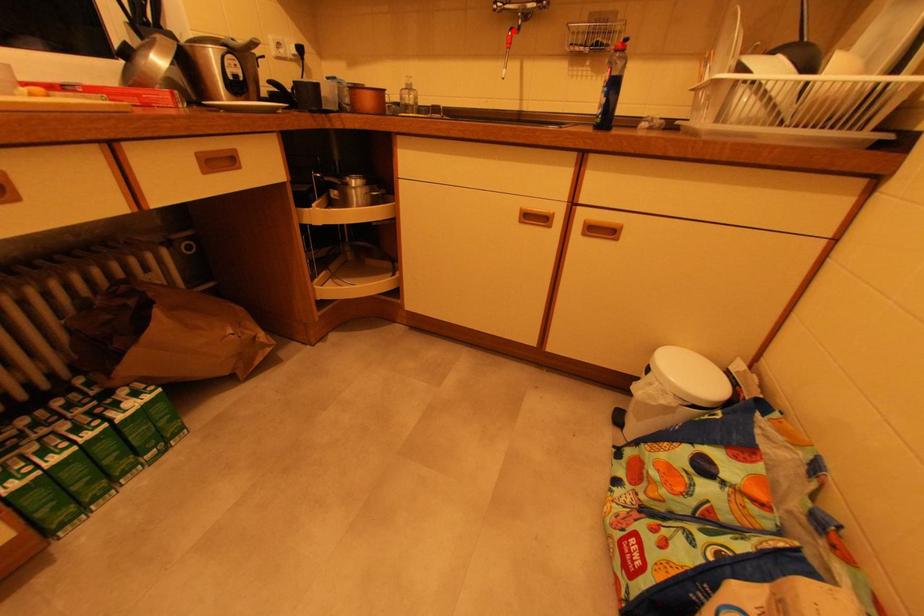
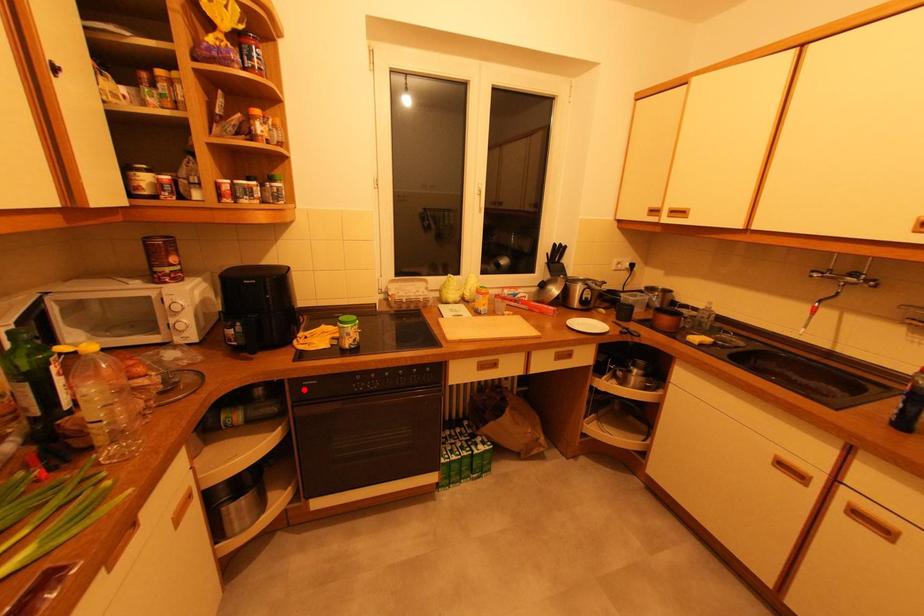
I am providing you with two images of the same scene from different viewpoints. A red point is marked on the first image and another point is marked on the second image. Does the point marked in image1 correspond to the same location as the one in image2?

No